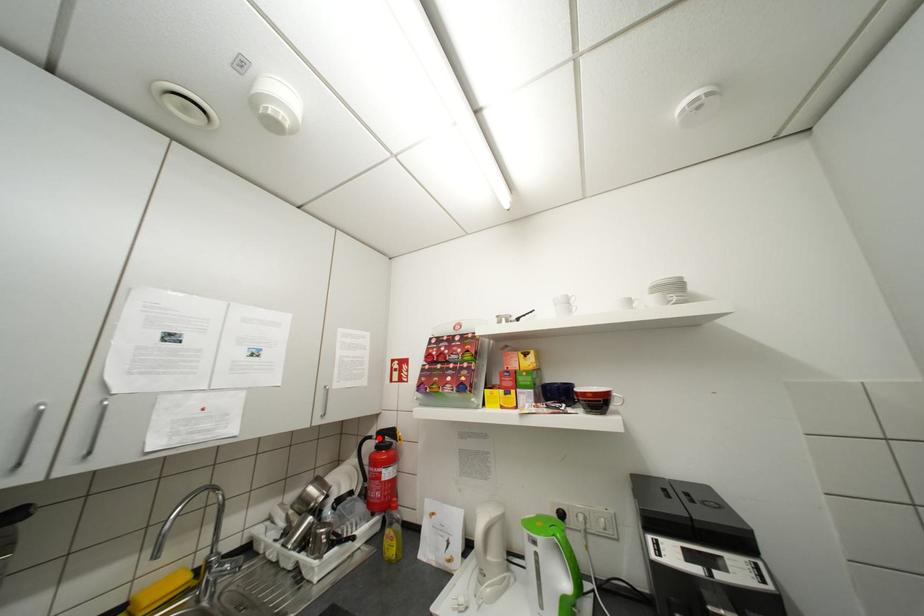
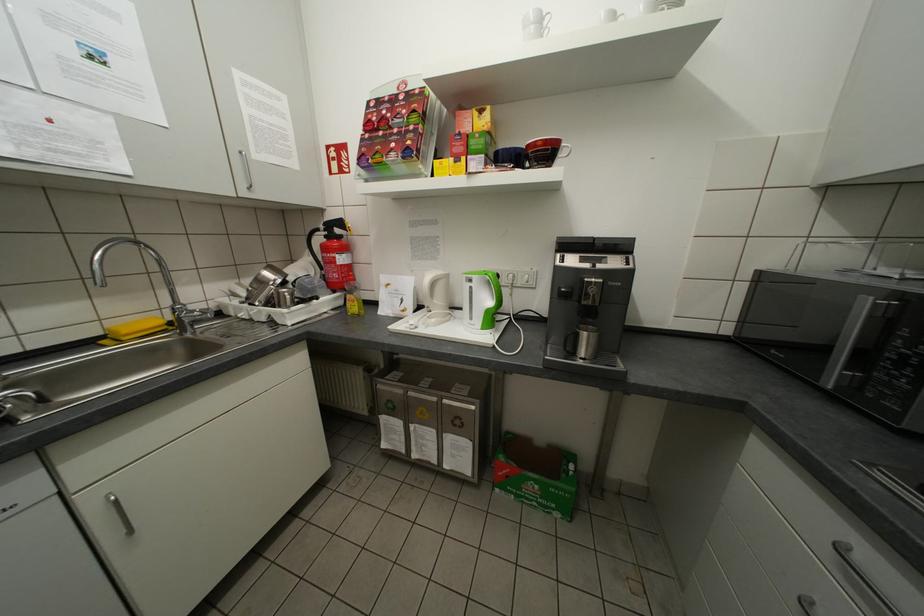
The point at the highlighted location is marked in the first image. Where is the corresponding point in the second image?

(325, 230)